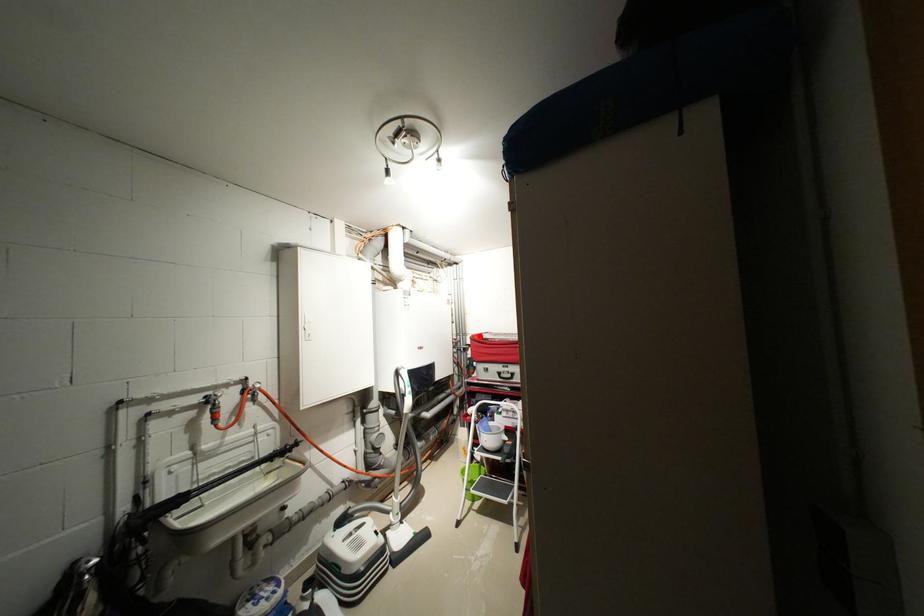
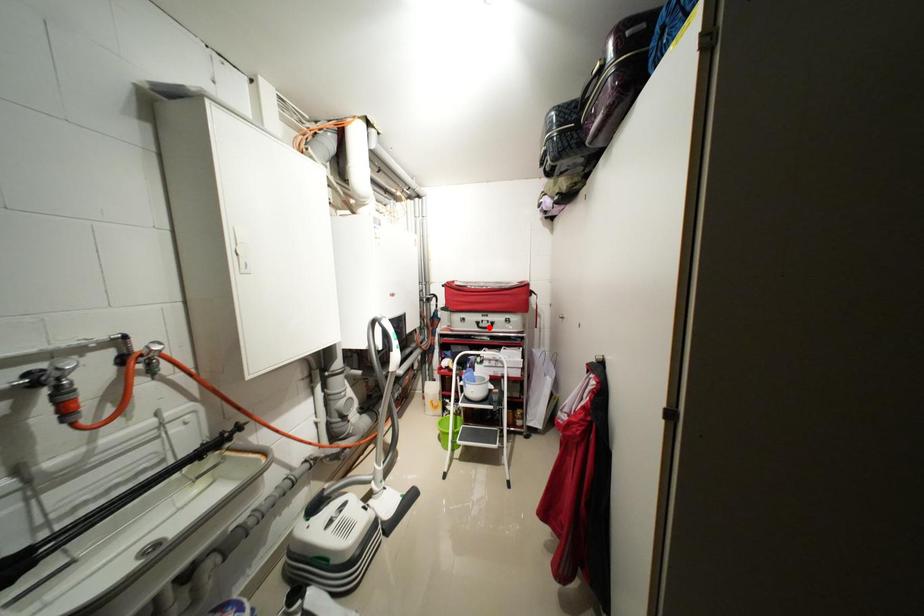
I am providing you with two images of the same scene from different viewpoints. A red point is marked on the first image and another point is marked on the second image. Does the point marked in image1 correspond to the same location as the one in image2?

No